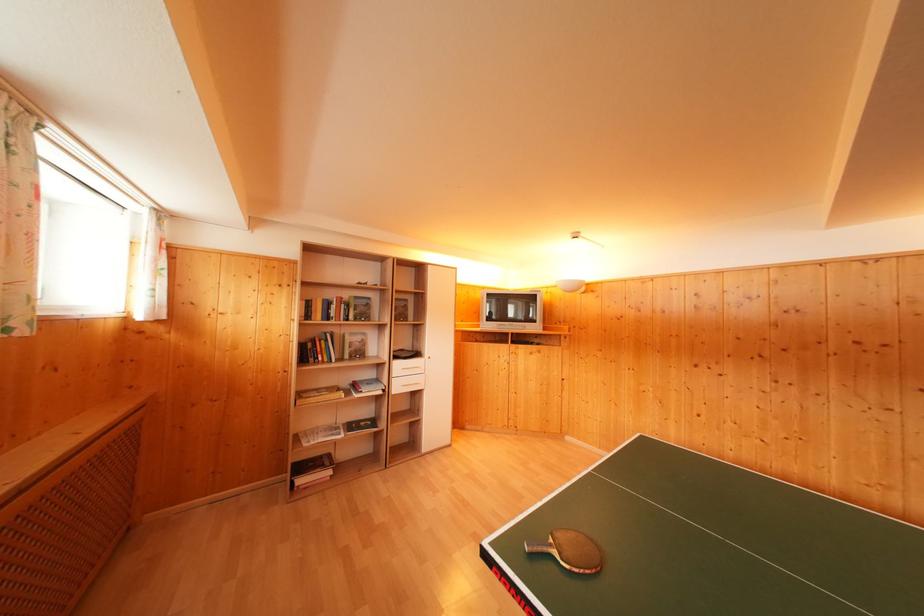
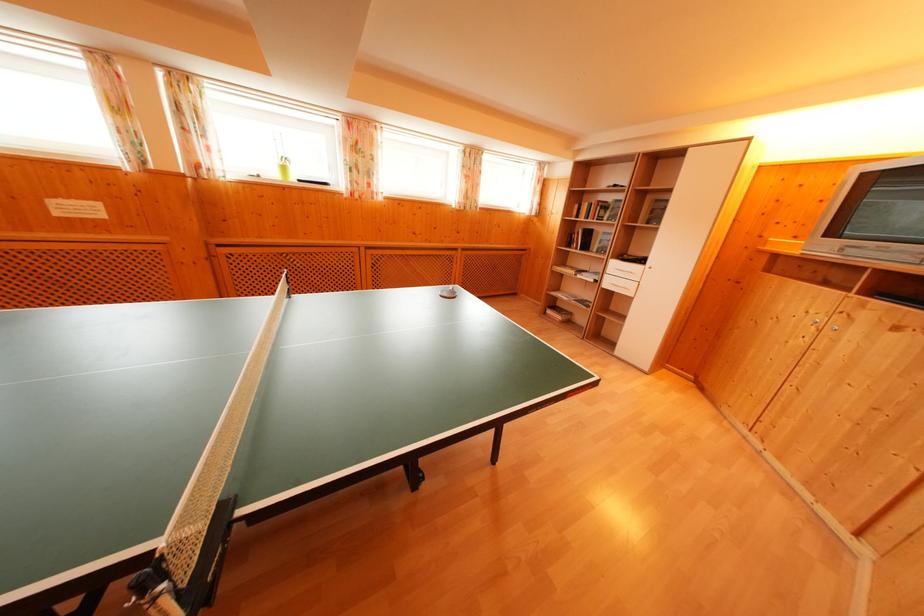
Locate, in the second image, the point that corresponds to pixel 398 379 in the first image.

(614, 276)